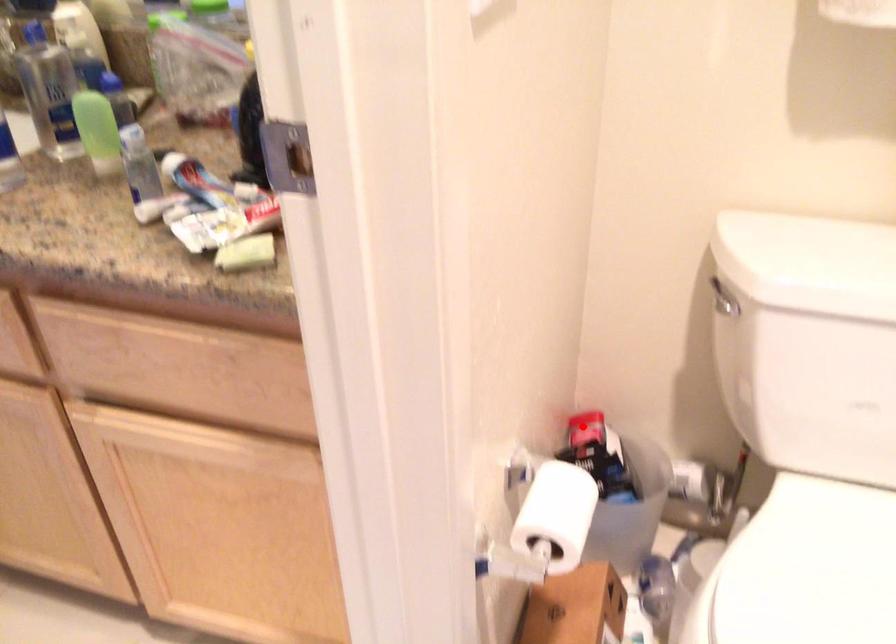
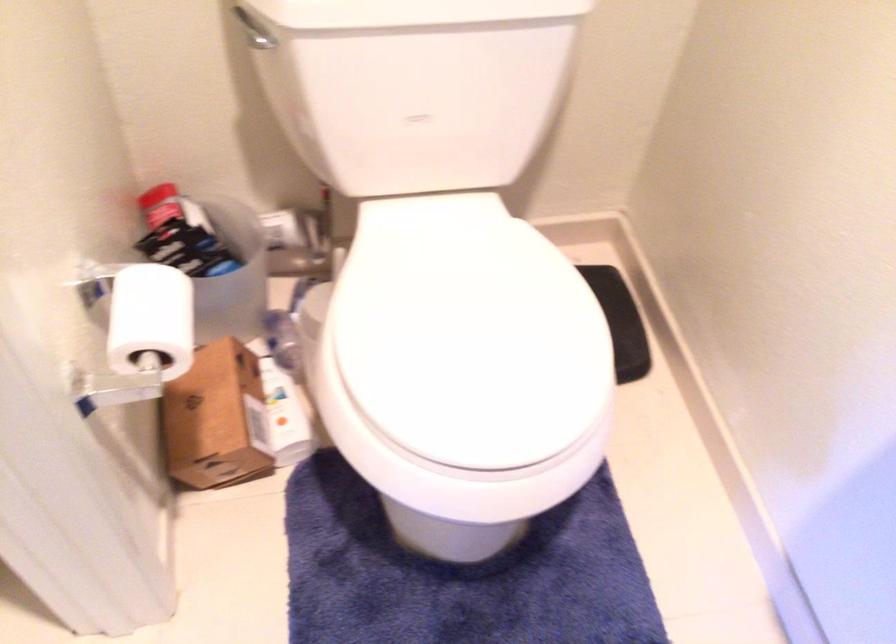
In the second image, find the point that corresponds to the highlighted location in the first image.

(159, 205)